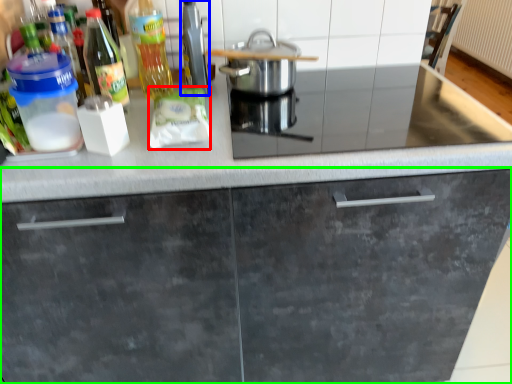
Question: Which object is the closest to the food (highlighted by a red box)? Choose among these: appliance (highlighted by a blue box) or cabinetry (highlighted by a green box).

Choices:
 (A) appliance
 (B) cabinetry

Answer: (A)